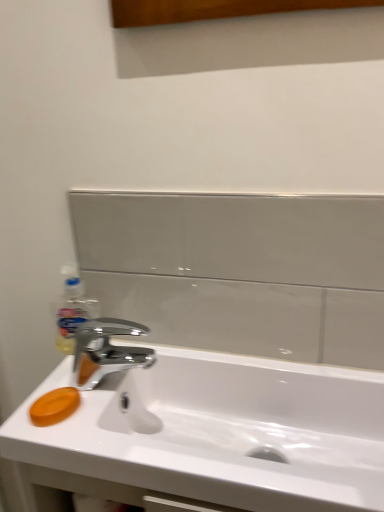
Question: Considering the relative positions of orange matte soap at lower left and chrome metallic faucet at center in the image provided, is orange matte soap at lower left to the left or to the right of chrome metallic faucet at center?

Choices:
 (A) left
 (B) right

Answer: (A)

Question: Is orange matte soap at lower left spatially inside chrome metallic faucet at center, or outside of it?

Choices:
 (A) inside
 (B) outside

Answer: (B)

Question: Estimate the real-world distances between objects in this image. Which object is closer to the translucent plastic soap dispenser at left?

Choices:
 (A) orange matte soap at lower left
 (B) chrome metallic faucet at center
 (C) white glossy sink at center

Answer: (B)

Question: Based on their relative distances, which object is farther from the white glossy sink at center?

Choices:
 (A) translucent plastic soap dispenser at left
 (B) chrome metallic faucet at center
 (C) orange matte soap at lower left

Answer: (A)